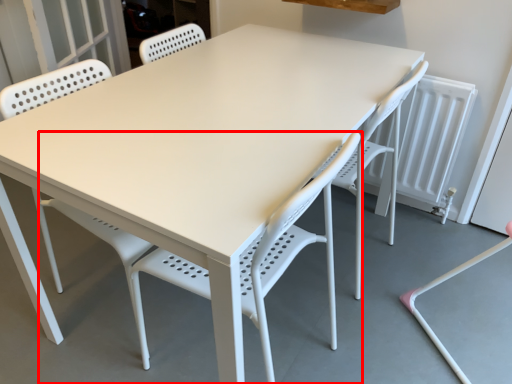
Question: Considering the relative positions of chair (annotated by the red box) and swivel chair in the image provided, where is chair (annotated by the red box) located with respect to the staircase?

Choices:
 (A) left
 (B) right

Answer: (A)